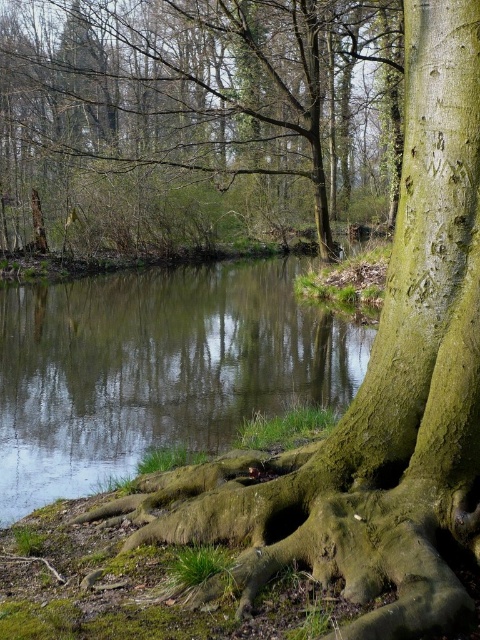
Question: Considering the relative positions of green mossy tree roots at lower left and green mossy stream at center in the image provided, where is green mossy tree roots at lower left located with respect to green mossy stream at center?

Choices:
 (A) below
 (B) above

Answer: (B)

Question: Which of the following is the closest to the observer?

Choices:
 (A) (109, 241)
 (B) (109, 467)

Answer: (B)

Question: Does green mossy tree roots at lower left appear under green mossy stream at center?

Choices:
 (A) yes
 (B) no

Answer: (B)

Question: Among these objects, which one is nearest to the camera?

Choices:
 (A) green mossy stream at center
 (B) green mossy tree roots at lower left

Answer: (A)

Question: Observing the image, what is the correct spatial positioning of green mossy tree roots at lower left in reference to green mossy stream at center?

Choices:
 (A) left
 (B) right

Answer: (B)

Question: Which of the following is the farthest from the observer?

Choices:
 (A) green mossy stream at center
 (B) green mossy tree roots at lower left

Answer: (B)